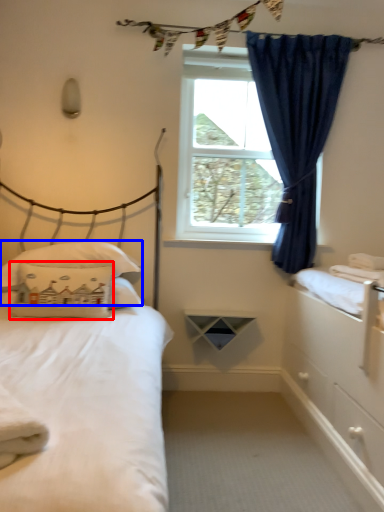
Question: Among these objects, which one is nearest to the camera, pillow (highlighted by a red box) or pillow (highlighted by a blue box)?

Choices:
 (A) pillow
 (B) pillow

Answer: (A)